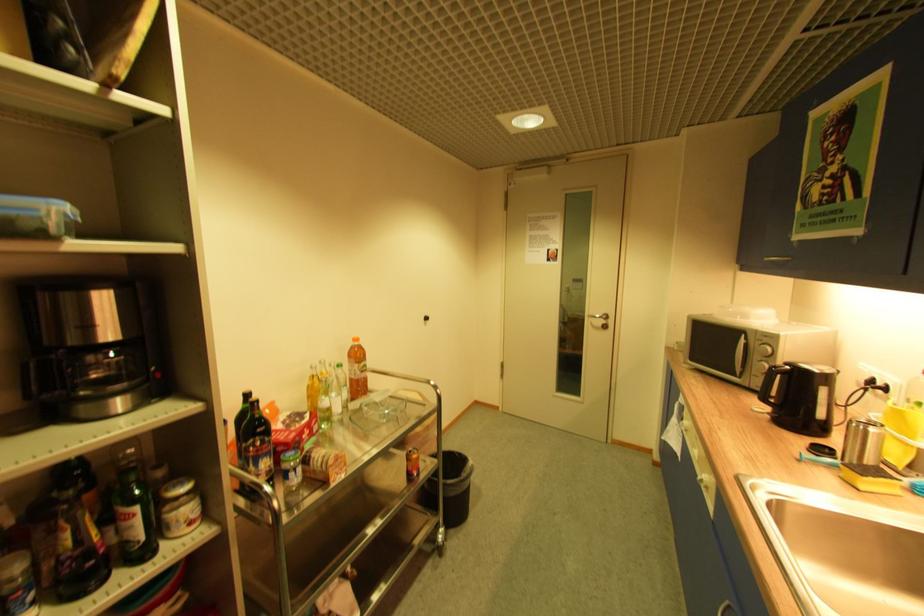
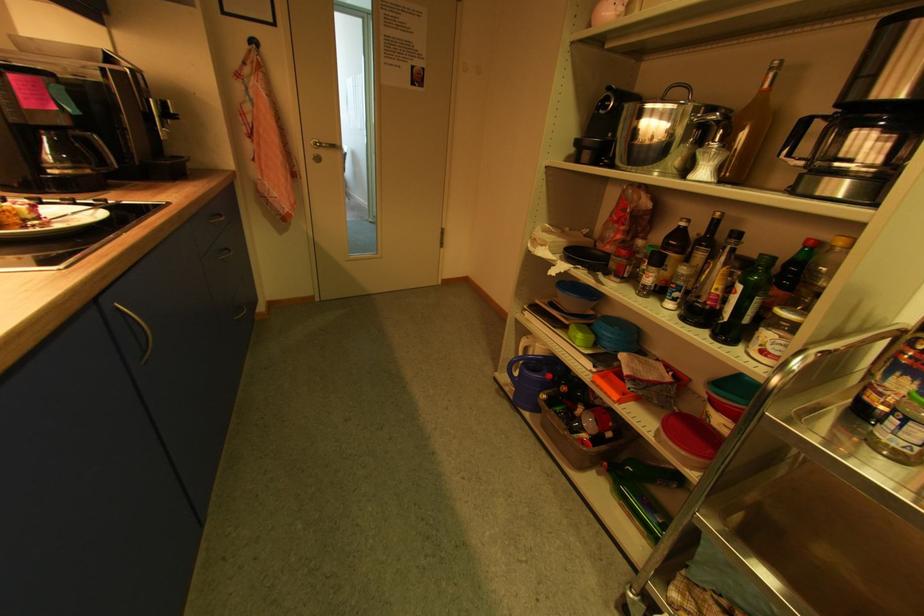
In the second image, find the point that corresponds to the point at 265,461 in the first image.

(904, 375)